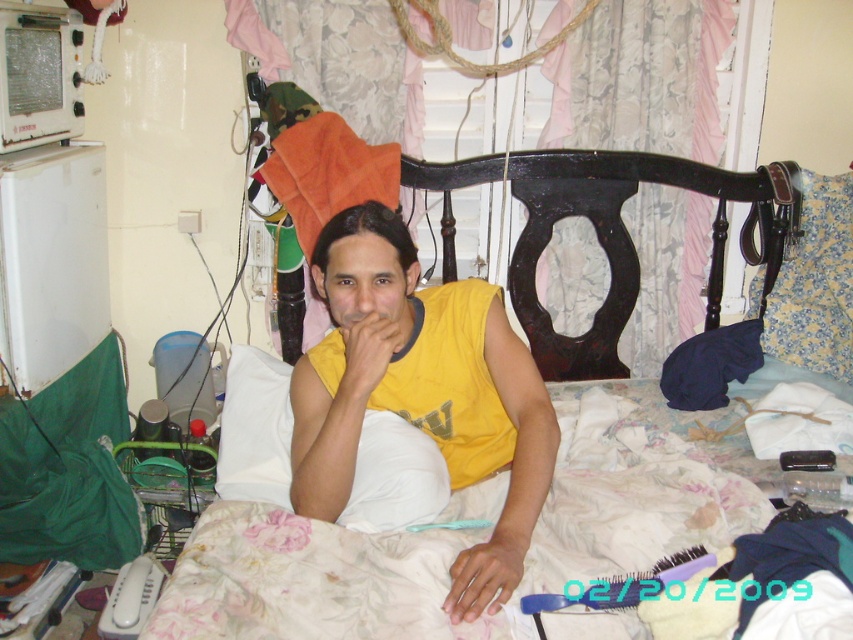
Between floral fabric bed at center and floral fabric pillow at right, which one is positioned higher?

Positioned higher is floral fabric pillow at right.

From the picture: Is floral fabric bed at center smaller than floral fabric pillow at right?

No.

Is point (207, 570) positioned in front of point (775, 320)?

That is True.

The image size is (853, 640). I want to click on floral fabric bed at center, so [308, 580].

Does floral fabric bed at center have a lesser height compared to yellow matte hand at center?

No, floral fabric bed at center is not shorter than yellow matte hand at center.

Between point (546, 582) and point (386, 340), which one is positioned in front?

Point (546, 582) is more forward.

Does point (737, 444) come in front of point (379, 330)?

No, it is not.

At what (x,y) coordinates should I click in order to perform the action: click on floral fabric bed at center. Please return your answer as a coordinate pair (x, y). Image resolution: width=853 pixels, height=640 pixels. Looking at the image, I should click on (308, 580).

Which is more to the right, dark brown wood headboard at center or yellow matte hand at center?

From the viewer's perspective, dark brown wood headboard at center appears more on the right side.

Does dark brown wood headboard at center appear under yellow matte hand at center?

Result: Incorrect, dark brown wood headboard at center is not positioned below yellow matte hand at center.

Find the location of a particular element. dark brown wood headboard at center is located at coordinates (608, 234).